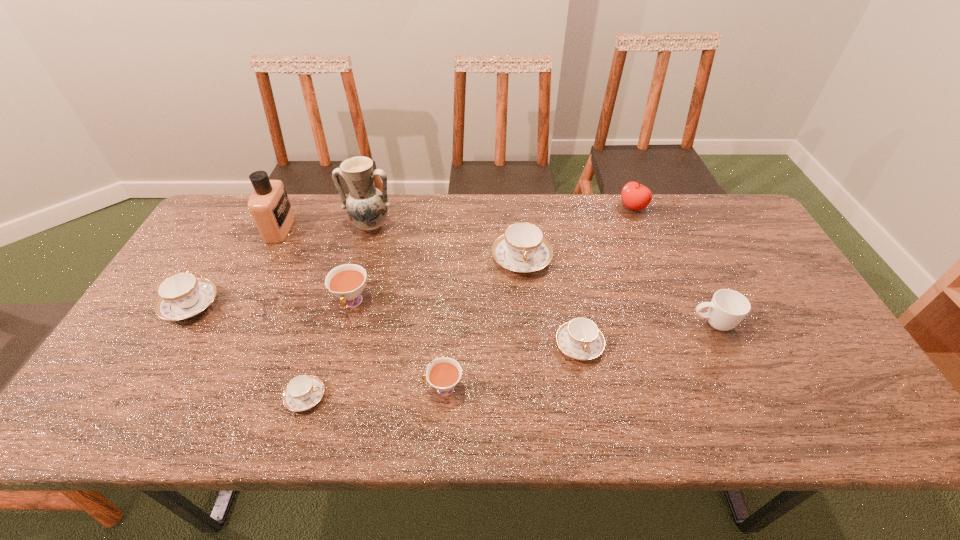
Find the location of a particular element. pottery is located at coordinates (367, 207).

Image resolution: width=960 pixels, height=540 pixels. Find the location of `the second object from left to right`. the second object from left to right is located at coordinates (269, 205).

Find the location of a particular element. beige perfume is located at coordinates (269, 205).

Locate an element on the screen. apple is located at coordinates (634, 196).

Find the location of a particular element. The height and width of the screenshot is (540, 960). the farthest blue teacup is located at coordinates [x=522, y=248].

The height and width of the screenshot is (540, 960). What are the coordinates of `the farthest teacup` in the screenshot? It's located at (522, 248).

Find the location of a particular element. The height and width of the screenshot is (540, 960). the farther white teacup is located at coordinates (346, 282).

Where is `the left white teacup`? the left white teacup is located at coordinates (346, 282).

The height and width of the screenshot is (540, 960). Identify the location of cup. (728, 308).

Where is `the third smallest blue teacup`? This screenshot has width=960, height=540. the third smallest blue teacup is located at coordinates (181, 296).